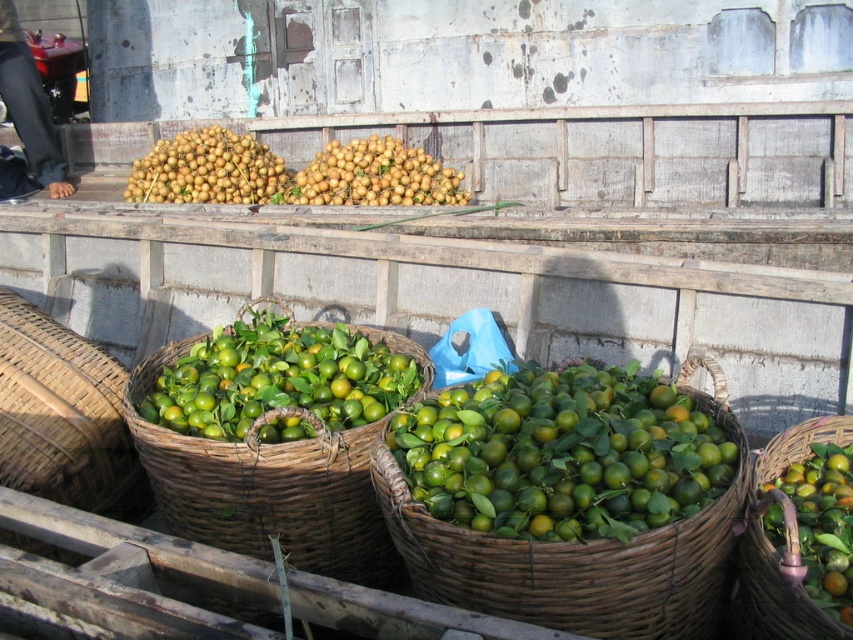
You are at a market and want to buy some nuts. You see a green woven basket at lower right and smooth brown nuts at center. Which one is located to the right of the other?

The green woven basket at lower right is to the right of the smooth brown nuts at center.

You are a customer at the market and want to pick up the green wicker basket at center and the green woven basket at lower right. Which basket should you reach for first to grab both without moving your position?

You should reach for the green wicker basket at center first since it is closer to you than the green woven basket at lower right, allowing you to grab both without moving your position.